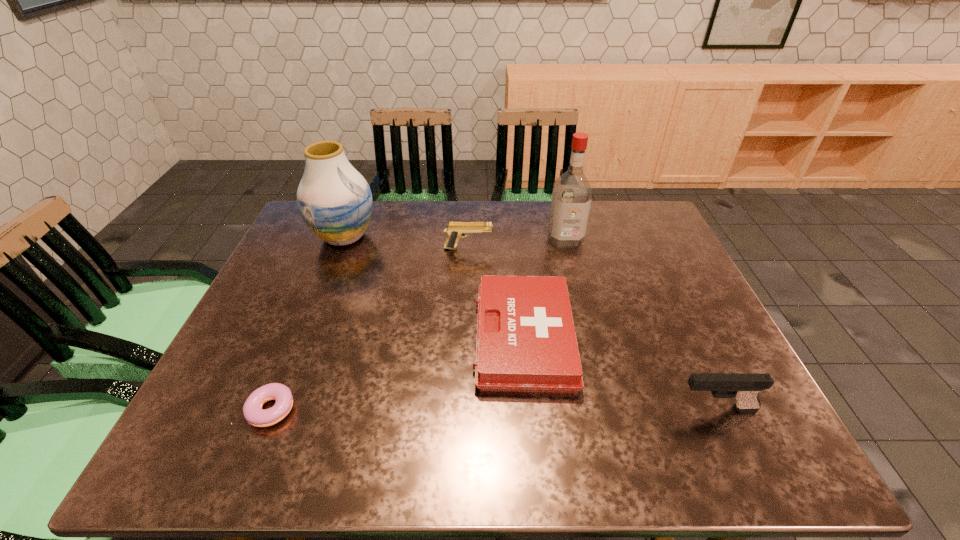
Locate an element on the screen. The width and height of the screenshot is (960, 540). free space between the shorter pistol and the doughnut is located at coordinates (369, 329).

At what (x,y) coordinates should I click in order to perform the action: click on empty space that is in between the liquor and the right pistol. Please return your answer as a coordinate pair (x, y). Image resolution: width=960 pixels, height=540 pixels. Looking at the image, I should click on (641, 323).

This screenshot has height=540, width=960. I want to click on free space that is in between the first-aid kit and the doughnut, so click(x=396, y=374).

This screenshot has height=540, width=960. I want to click on vacant area that lies between the first-aid kit and the vase, so click(x=434, y=287).

You are a GUI agent. You are given a task and a screenshot of the screen. Output one action in this format:
    pyautogui.click(x=<x>, y=<y>)
    Task: Click on the free spot between the taller pistol and the doughnut
    The image size is (960, 540).
    Given the screenshot: What is the action you would take?
    pyautogui.click(x=492, y=409)

The height and width of the screenshot is (540, 960). Identify the location of free space between the first-aid kit and the vase. (434, 287).

The height and width of the screenshot is (540, 960). I want to click on free space between the rightmost object and the liquor, so click(x=641, y=323).

Where is `free spot between the farther pistol and the vase`? The image size is (960, 540). free spot between the farther pistol and the vase is located at coordinates (406, 242).

Identify the location of vacant region between the nearer pistol and the left pistol. (592, 328).

You are a GUI agent. You are given a task and a screenshot of the screen. Output one action in this format:
    pyautogui.click(x=<x>, y=<y>)
    Task: Click on the object identified as the fifth closest to the third tallest object
    The height and width of the screenshot is (540, 960).
    Given the screenshot: What is the action you would take?
    pyautogui.click(x=335, y=201)